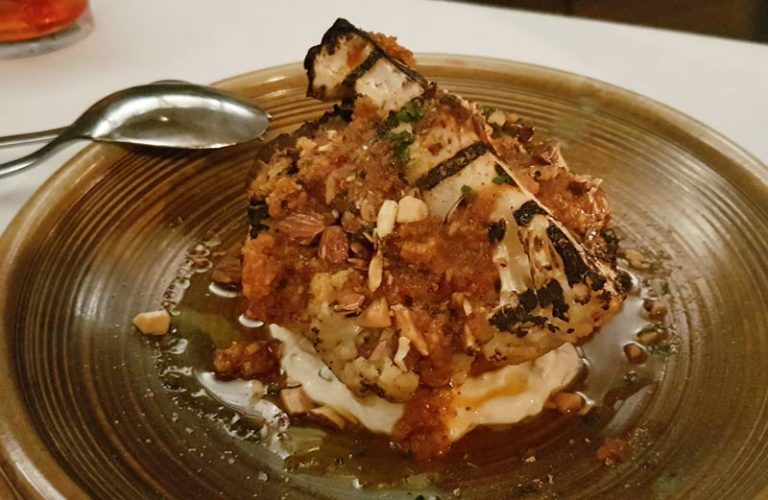
In order to click on white table top in this screenshot , I will do `click(169, 40)`.